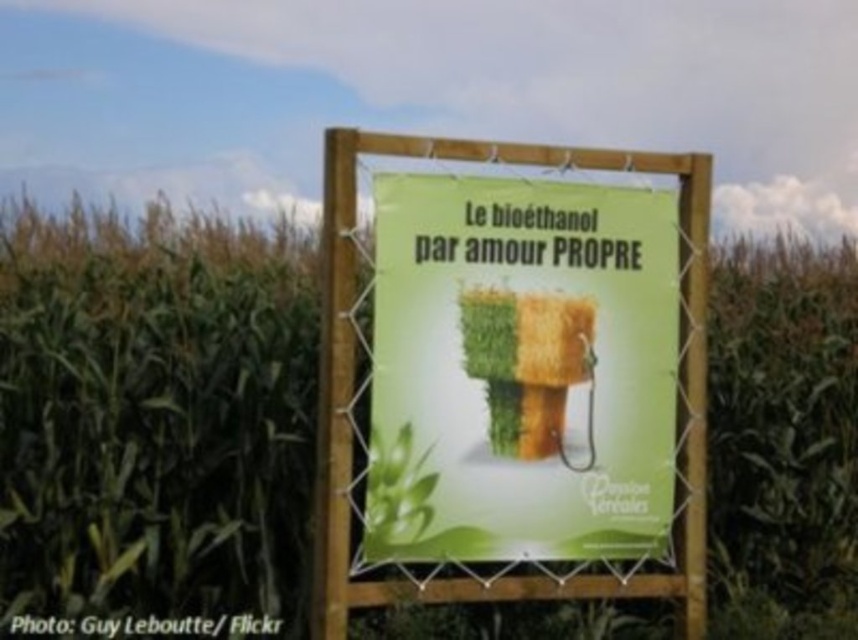
You are a farmer checking the growth of your crops. You notice the green leafy corn at center and the green paper sign at center in your cornfield. Which object is taller?

The green paper sign at center is taller than the green leafy corn at center.

You are standing in a cornfield and see a signboard with a green poster. There is a point marked at coordinates (154, 413). What does this point represent?

The point at coordinates (154, 413) represents green leafy corn at center.